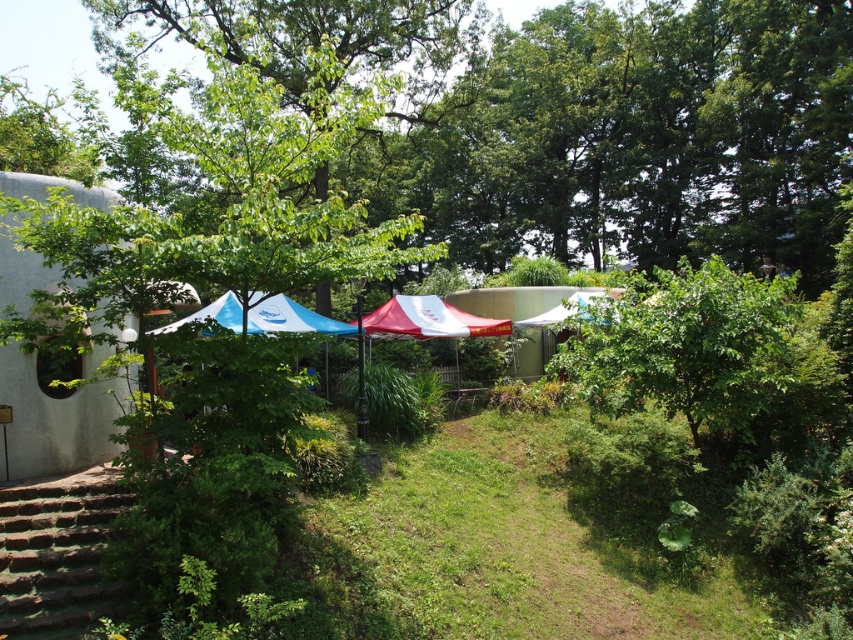
You are planning to set up a new canopy in the garden. You want to know if the red fabric canopy at center is taller than the white fabric canopy at center. Based on the scene, can you determine this?

The red fabric canopy at center is not as tall as white fabric canopy at center, so the white fabric canopy at center is taller.

In the scene shown: You are planning to set up a picnic in the garden and have chosen a spot between the red fabric canopy at center and the blue fabric canopy at center. Which canopy is closer to your left side when facing the canopies?

The blue fabric canopy at center is closer to your left side because the red fabric canopy at center is positioned to the right of it.